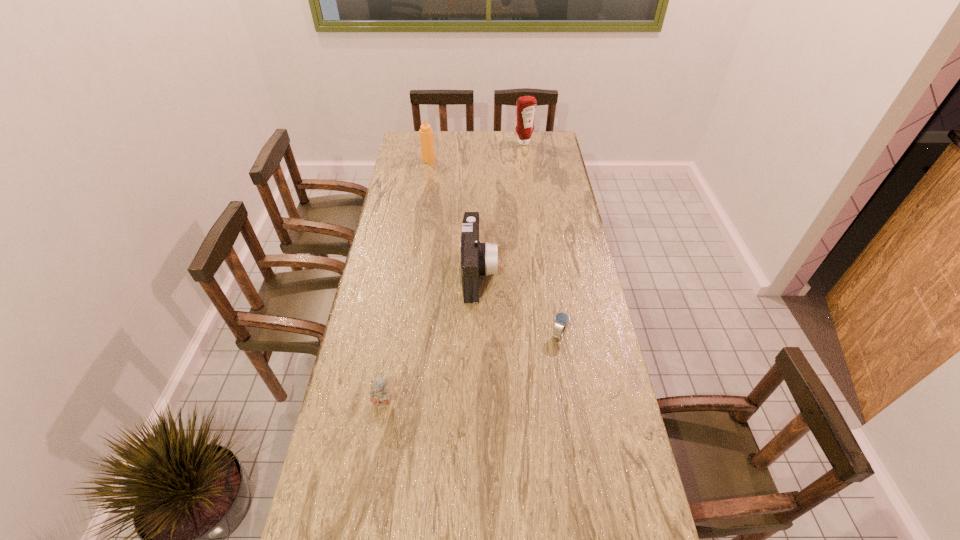
Find the location of a particular element. Image resolution: width=960 pixels, height=540 pixels. the right condiment is located at coordinates (526, 106).

This screenshot has width=960, height=540. Identify the location of the farthest object. (526, 106).

Identify the location of the second farthest object. (426, 133).

Locate an element on the screen. Image resolution: width=960 pixels, height=540 pixels. the left condiment is located at coordinates (426, 133).

The image size is (960, 540). What are the coordinates of `the third object from left to right` in the screenshot? It's located at (477, 259).

At what (x,y) coordinates should I click in order to perform the action: click on the third nearest object. Please return your answer as a coordinate pair (x, y). This screenshot has height=540, width=960. Looking at the image, I should click on (477, 259).

This screenshot has width=960, height=540. What are the coordinates of `the second shortest object` in the screenshot? It's located at (380, 397).

Identify the location of teddy bear. This screenshot has height=540, width=960. (380, 397).

You are a GUI agent. You are given a task and a screenshot of the screen. Output one action in this format:
    pyautogui.click(x=<x>, y=<y>)
    Task: Click on the second nearest object
    
    Given the screenshot: What is the action you would take?
    pyautogui.click(x=561, y=319)

The image size is (960, 540). In order to click on watch in this screenshot , I will do `click(561, 319)`.